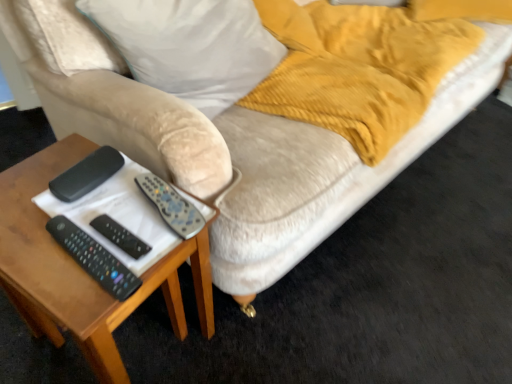
Where is `free spot in front of black plastic remote control at left`? Image resolution: width=512 pixels, height=384 pixels. free spot in front of black plastic remote control at left is located at coordinates (40, 251).